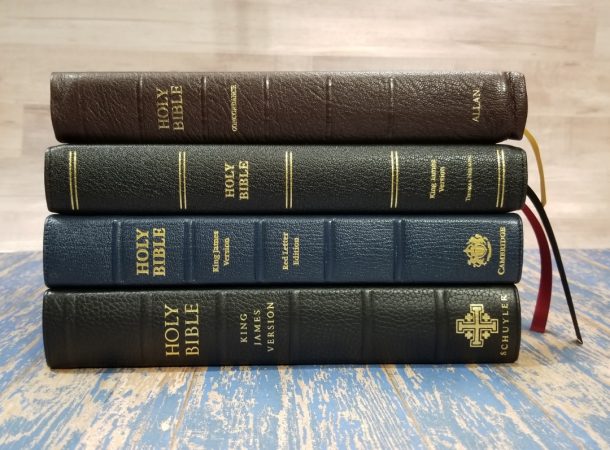
Identify the location of green book. [x=342, y=168].